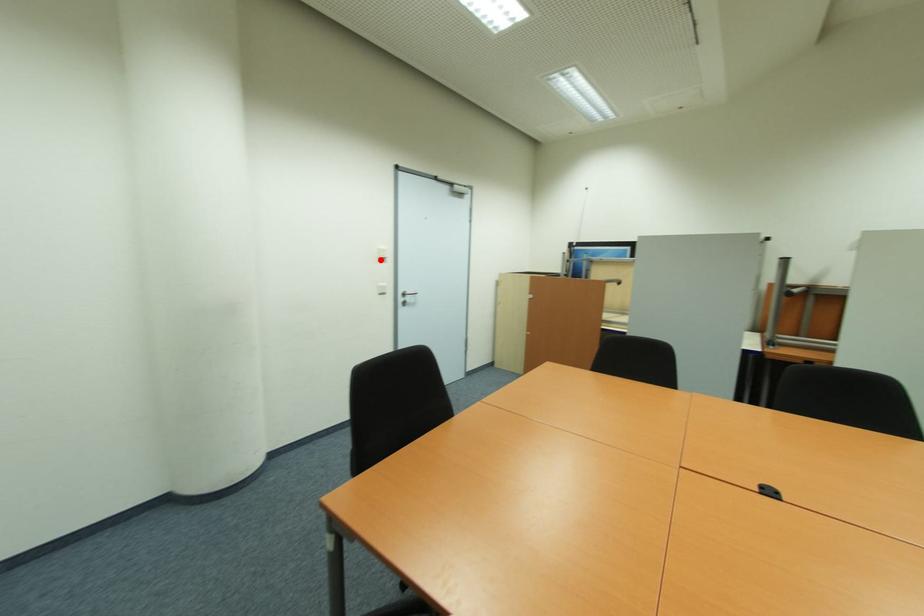
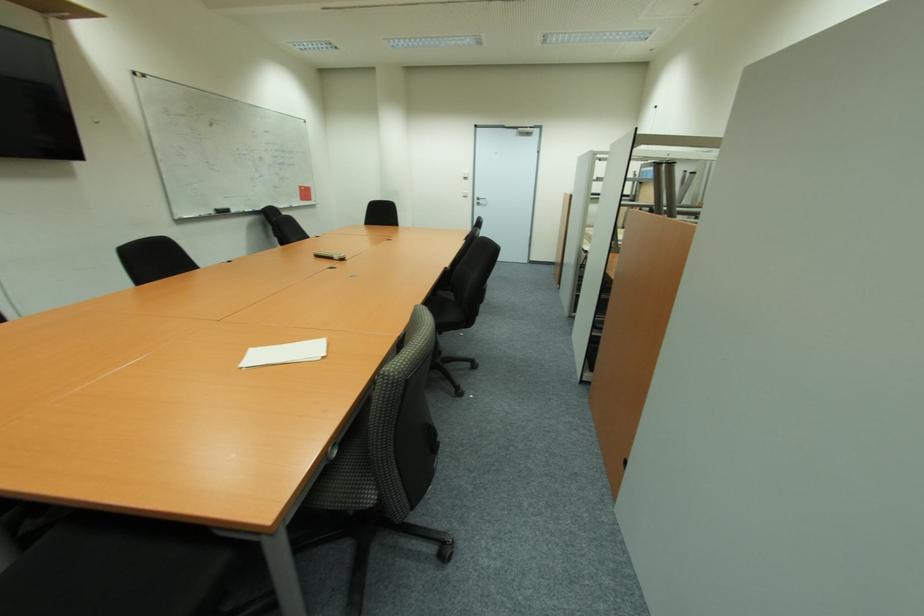
Question: A red point is marked in image1. In image2, is the corresponding 3D point closer to the camera or farther? Reply with the corresponding letter.

Choices:
 (A) The corresponding 3D point is closer.
 (B) The corresponding 3D point is farther.

Answer: (A)